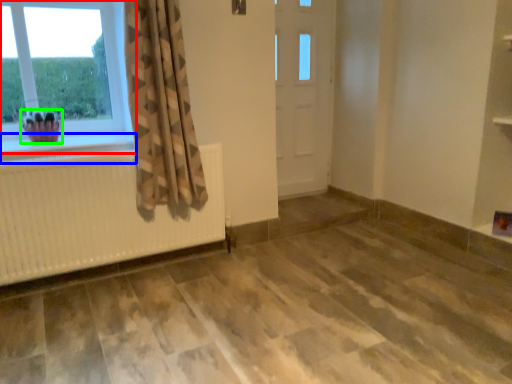
Question: Which is farther away from window (highlighted by a red box)? window sill (highlighted by a blue box) or plant (highlighted by a green box)?

Choices:
 (A) window sill
 (B) plant

Answer: (A)